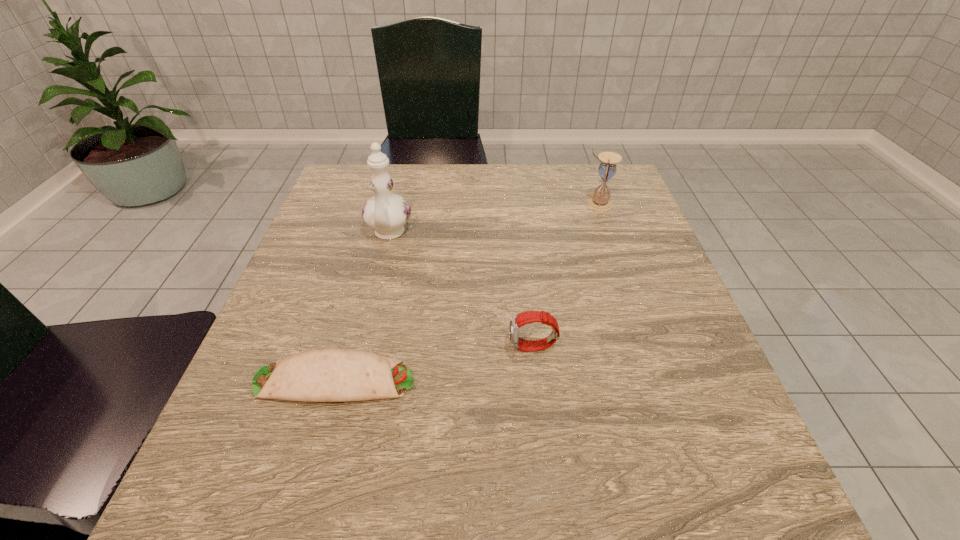
At what (x,y) coordinates should I click in order to perform the action: click on the tallest object. Please return your answer as a coordinate pair (x, y). Image resolution: width=960 pixels, height=540 pixels. Looking at the image, I should click on (387, 213).

I want to click on chinaware, so click(x=387, y=213).

At what (x,y) coordinates should I click in order to perform the action: click on the rightmost object. Please return your answer as a coordinate pair (x, y). This screenshot has width=960, height=540. Looking at the image, I should click on (600, 201).

Where is `hourglass`? The image size is (960, 540). hourglass is located at coordinates pyautogui.click(x=600, y=201).

Image resolution: width=960 pixels, height=540 pixels. What are the coordinates of `watch` in the screenshot? It's located at (516, 321).

This screenshot has height=540, width=960. I want to click on the second shortest object, so click(x=516, y=321).

You are a GUI agent. You are given a task and a screenshot of the screen. Output one action in this format:
    pyautogui.click(x=<x>, y=<y>)
    Task: Click on the shortest object
    Image resolution: width=960 pixels, height=540 pixels.
    Given the screenshot: What is the action you would take?
    pyautogui.click(x=327, y=374)

At what (x,y) coordinates should I click in order to perform the action: click on free space located at the spout of the second farthest object. Please return your answer as a coordinate pair (x, y). Looking at the image, I should click on (367, 325).

Image resolution: width=960 pixels, height=540 pixels. I want to click on blank area located 0.290m on the front of the hourglass, so click(x=628, y=292).

You are a GUI agent. You are given a task and a screenshot of the screen. Output one action in this format:
    pyautogui.click(x=<x>, y=<y>)
    Task: Click on the vacant region located 0.050m on the face of the third tallest object
    The image size is (960, 540).
    Given the screenshot: What is the action you would take?
    click(x=482, y=348)